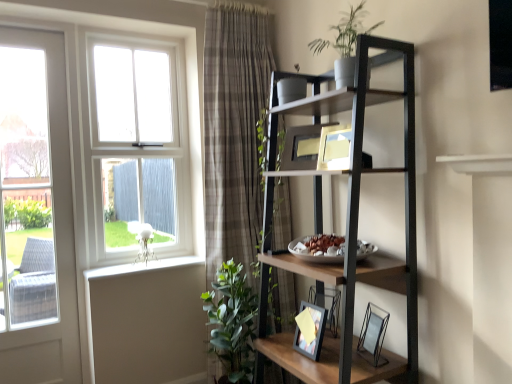
The height and width of the screenshot is (384, 512). What do you see at coordinates (234, 131) in the screenshot?
I see `plaid fabric curtain at center` at bounding box center [234, 131].

The width and height of the screenshot is (512, 384). Identify the location of plaid fabric curtain at center. (234, 131).

You are a GUI agent. You are given a task and a screenshot of the screen. Output one action in this format:
    pyautogui.click(x=<x>, y=<y>)
    Task: Click on the green leafy plant at lower left
    The image size is (512, 384).
    Given the screenshot: What is the action you would take?
    pyautogui.click(x=232, y=323)

Identify the location of white glossy door at left. The height and width of the screenshot is (384, 512). (x=36, y=213).

Identify the location of matte wooden picture frame at upper center, the second picture frame positioned from the front. (302, 147).

Where is `clear glass picture frame at lower right, which ranks as the 2th picture frame in back-to-front order`? Image resolution: width=512 pixels, height=384 pixels. clear glass picture frame at lower right, which ranks as the 2th picture frame in back-to-front order is located at coordinates (373, 335).

Is white painted wood at lower left smaller than green matte plant at upper center?

Correct, white painted wood at lower left occupies less space than green matte plant at upper center.

Is green matte plant at upper center completely or partially inside white painted wood at lower left?

That's incorrect, green matte plant at upper center is not inside white painted wood at lower left.

Which of these two, white painted wood at lower left or green matte plant at upper center, stands shorter?

white painted wood at lower left is shorter.

Is green matte plant at upper center bigger or smaller than white wood window at upper left?

green matte plant at upper center is smaller than white wood window at upper left.

This screenshot has height=384, width=512. Find the location of `vegetation lying in front of the white wood window at upper left`. vegetation lying in front of the white wood window at upper left is located at coordinates (345, 32).

Is green matte plant at upper center inside or outside of white wood window at upper left?

green matte plant at upper center lies outside white wood window at upper left.

Considering the relative positions of green matte plant at upper center and white wood window at upper left in the image provided, is green matte plant at upper center to the left of white wood window at upper left from the viewer's perspective?

No, green matte plant at upper center is not to the left of white wood window at upper left.

How different are the orientations of white wood window at upper left and white glossy door at left in degrees?

They differ by 0.00211 degrees in their facing directions.

Can you confirm if white wood window at upper left is smaller than white glossy door at left?

Correct, white wood window at upper left occupies less space than white glossy door at left.

Is white wood window at upper left positioned with its back to white glossy door at left?

No.

Is white wood window at upper left not inside white glossy door at left?

Absolutely, white wood window at upper left is external to white glossy door at left.

Locate an element on the screen. Image resolution: width=512 pixels, height=384 pixels. vegetation that appears above the white wood window at upper left (from a real-world perspective) is located at coordinates (345, 32).

Can you confirm if white wood window at upper left is bigger than green matte plant at upper center?

Indeed, white wood window at upper left has a larger size compared to green matte plant at upper center.

Is white wood window at upper left not close to green matte plant at upper center?

Indeed, white wood window at upper left is not near green matte plant at upper center.

From the image's perspective, which is below, white wood window at upper left or green matte plant at upper center?

white wood window at upper left appears lower in the image.

Is metallic black shelf at upper right in contact with plaid fabric curtain at center?

No, metallic black shelf at upper right is not touching plaid fabric curtain at center.

From a real-world perspective, who is located lower, metallic black shelf at upper right or plaid fabric curtain at center?

metallic black shelf at upper right.

Between metallic black shelf at upper right and plaid fabric curtain at center, which one has smaller size?

Smaller between the two is plaid fabric curtain at center.

From the picture: Who is bigger, metallic black shelf at upper right or green leafy plant at lower left?

metallic black shelf at upper right is bigger.

The width and height of the screenshot is (512, 384). In order to click on houseplant located behind the metallic black shelf at upper right in this screenshot , I will do `click(232, 323)`.

Which object is wider, metallic black shelf at upper right or green leafy plant at lower left?

With larger width is metallic black shelf at upper right.

In the scene shown: Is the surface of metallic black shelf at upper right in direct contact with green leafy plant at lower left?

There is a gap between metallic black shelf at upper right and green leafy plant at lower left.

From a real-world perspective, which object rests below the other?

From a 3D spatial view, matte wooden picture frame at upper center, acting as the 1th picture frame starting from the back, is below.

Between green matte plant at upper center and matte wooden picture frame at upper center, placed as the 2th picture frame when sorted from bottom to top, which one is positioned in front?

green matte plant at upper center is closer to the camera.

Would you say green matte plant at upper center is to the left or to the right of matte wooden picture frame at upper center, the 2th picture frame in the right-to-left sequence, in the picture?

In the image, green matte plant at upper center appears on the right side of matte wooden picture frame at upper center, the 2th picture frame in the right-to-left sequence.

At what (x,y) coordinates should I click in order to perform the action: click on window sill located behind the green matte plant at upper center. Please return your answer as a coordinate pair (x, y). Looking at the image, I should click on (142, 267).

Locate an element on the screen. This screenshot has height=384, width=512. bay window on the left of green matte plant at upper center is located at coordinates (137, 146).

Based on the photo, from the image, which object appears to be nearer to white wood window at upper left, green matte plant at upper center or green leafy plant at lower left?

green leafy plant at lower left is positioned closer to the anchor white wood window at upper left.

Looking at the image, which one is located further to green leafy plant at lower left, white painted wood at lower left or plaid fabric curtain at center?

white painted wood at lower left lies further to green leafy plant at lower left than the other object.

Considering their positions, is green leafy plant at lower left positioned closer to white wood window at upper left than plaid fabric curtain at center?

Among the two, plaid fabric curtain at center is located nearer to white wood window at upper left.

Estimate the real-world distances between objects in this image. Which object is closer to white wood window at upper left, white painted wood at lower left or clear glass picture frame at lower right, the second picture frame in the top-to-bottom sequence?

white painted wood at lower left is positioned closer to the anchor white wood window at upper left.

When comparing their distances from plaid fabric curtain at center, does green matte plant at upper center or white painted wood at lower left seem closer?

white painted wood at lower left lies closer to plaid fabric curtain at center than the other object.

When comparing their distances from white wood window at upper left, does green matte plant at upper center or white glossy door at left seem closer?

white glossy door at left is positioned closer to the anchor white wood window at upper left.

When comparing their distances from metallic black shelf at upper right, does matte wooden picture frame at upper center, acting as the 1th picture frame starting from the back, or green matte plant at upper center seem further?

green matte plant at upper center.

Considering their positions, is green leafy plant at lower left positioned closer to clear glass picture frame at lower right, which appears as the first picture frame when ordered from the bottom, than white wood window at upper left?

The object closer to clear glass picture frame at lower right, which appears as the first picture frame when ordered from the bottom, is green leafy plant at lower left.

At what (x,y) coordinates should I click in order to perform the action: click on shelf between white painted wood at lower left and clear glass picture frame at lower right, the second picture frame in the top-to-bottom sequence. Please return your answer as a coordinate pair (x, y). Looking at the image, I should click on (359, 199).

This screenshot has width=512, height=384. Identify the location of window sill between white wood window at upper left and clear glass picture frame at lower right, the first picture frame when ordered from right to left, from left to right. (142, 267).

What are the coordinates of `curtain situated between white painted wood at lower left and clear glass picture frame at lower right, the second picture frame in the top-to-bottom sequence, from left to right` in the screenshot? It's located at (234, 131).

Locate an element on the screen. The height and width of the screenshot is (384, 512). shelf between matte wooden picture frame at upper center, placed as the 2th picture frame when sorted from bottom to top, and clear glass picture frame at lower right, which ranks as the 2th picture frame in back-to-front order, from top to bottom is located at coordinates (359, 199).